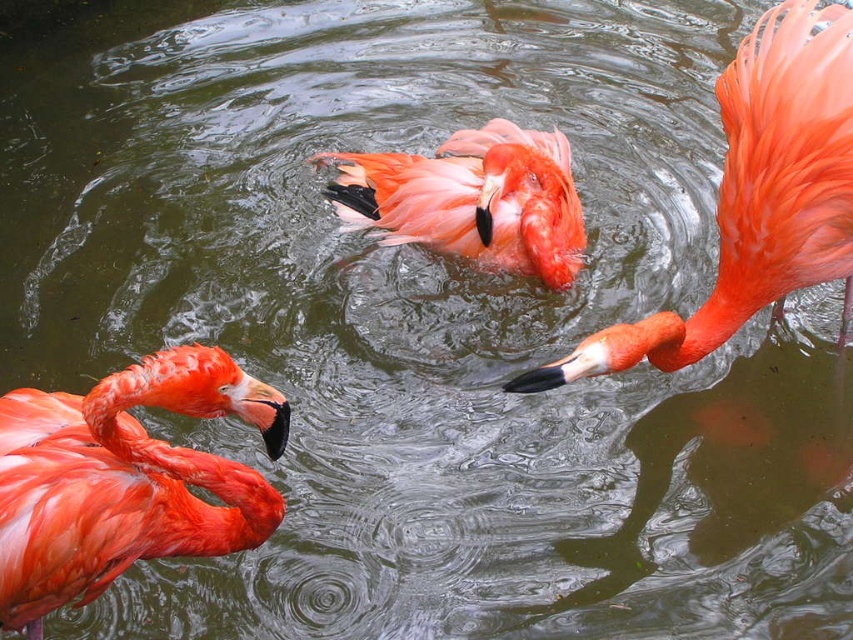
Who is lower down, matte pink flamingo at left or matte pink flamingo at center?

Positioned lower is matte pink flamingo at left.

Locate an element on the screen. matte pink flamingo at left is located at coordinates (125, 480).

You are a GUI agent. You are given a task and a screenshot of the screen. Output one action in this format:
    pyautogui.click(x=<x>, y=<y>)
    Task: Click on the matte pink flamingo at left
    Image resolution: width=853 pixels, height=640 pixels.
    Given the screenshot: What is the action you would take?
    pyautogui.click(x=125, y=480)

Does matte pink flamingo at left appear on the right side of matte orange flamingo at right?

Incorrect, matte pink flamingo at left is not on the right side of matte orange flamingo at right.

Locate an element on the screen. The image size is (853, 640). matte pink flamingo at left is located at coordinates (125, 480).

Identify the location of matte pink flamingo at left. The height and width of the screenshot is (640, 853). (125, 480).

Describe the element at coordinates (757, 195) in the screenshot. The height and width of the screenshot is (640, 853). I see `matte orange flamingo at right` at that location.

Who is more forward, (811, 204) or (392, 186)?

Point (811, 204) is in front.

Where is `matte orange flamingo at right`? matte orange flamingo at right is located at coordinates 757,195.

I want to click on matte orange flamingo at right, so click(757, 195).